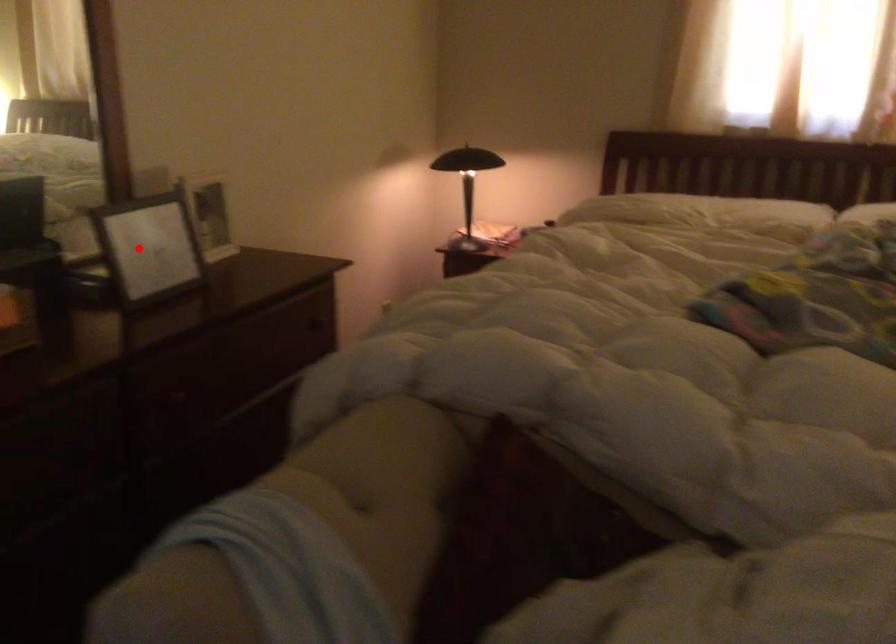
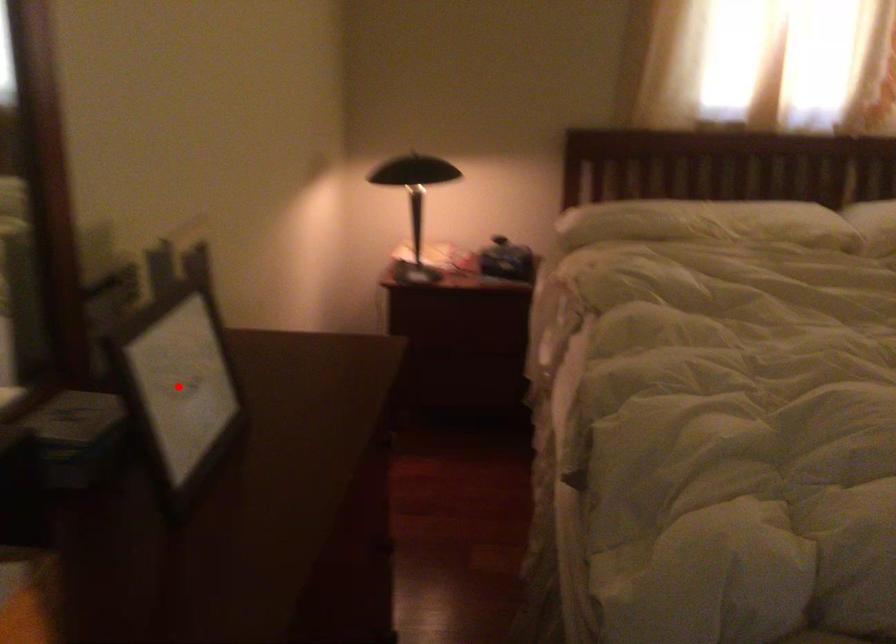
I am providing you with two images of the same scene from different viewpoints. A red point is marked on the first image and another point is marked on the second image. Do the highlighted points in image1 and image2 indicate the same real-world spot?

Yes